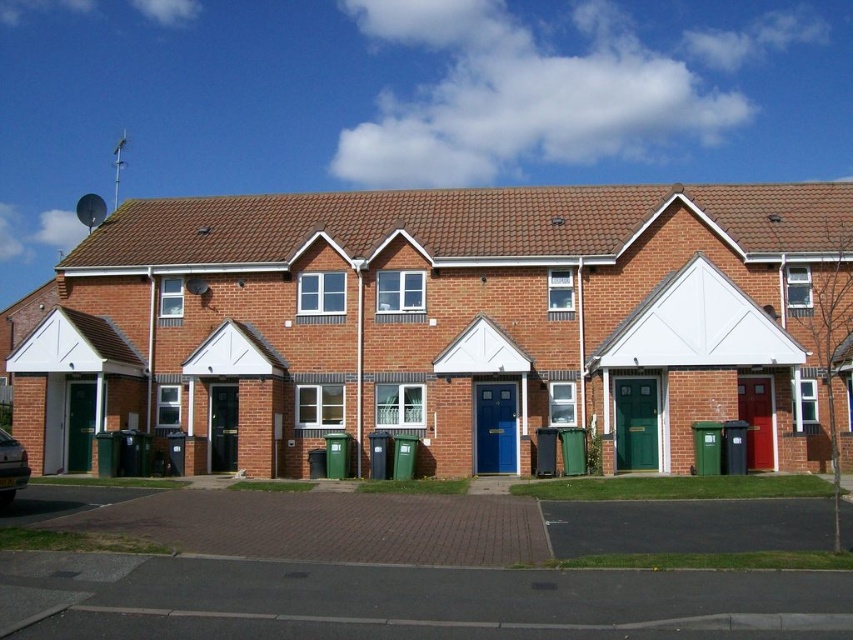
Question: Is brick house at center in front of metallic silver car at lower left?

Choices:
 (A) no
 (B) yes

Answer: (A)

Question: Is brick house at center smaller than metallic silver car at lower left?

Choices:
 (A) no
 (B) yes

Answer: (A)

Question: Which of the following is the closest to the observer?

Choices:
 (A) brick house at center
 (B) metallic silver car at lower left

Answer: (B)

Question: Does brick house at center have a larger size compared to metallic silver car at lower left?

Choices:
 (A) no
 (B) yes

Answer: (B)